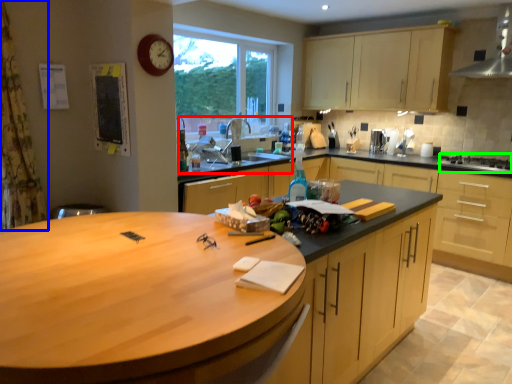
Question: Which is nearer to the sink (highlighted by a red box)? curtain (highlighted by a blue box) or gas stove (highlighted by a green box).

Choices:
 (A) curtain
 (B) gas stove

Answer: (A)